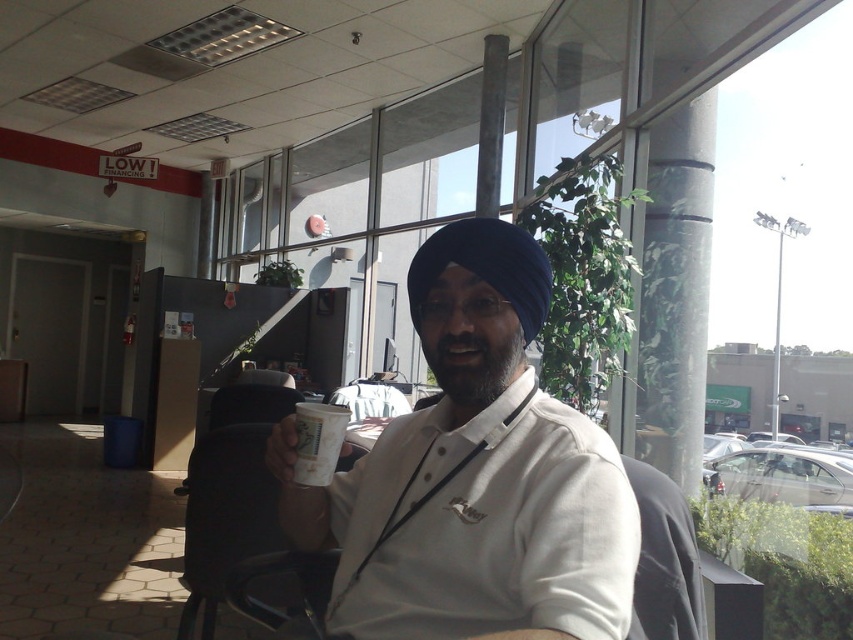
You are a customer service representative in a bank lobby. You need to place the white paper cup at center on the counter without it touching the white matte shirt at center. Is the cup smaller than the shirt in width to allow this?

The white matte shirt at center has a larger width than the white paper cup at center, so yes, the cup can be placed without touching the shirt as it is narrower.